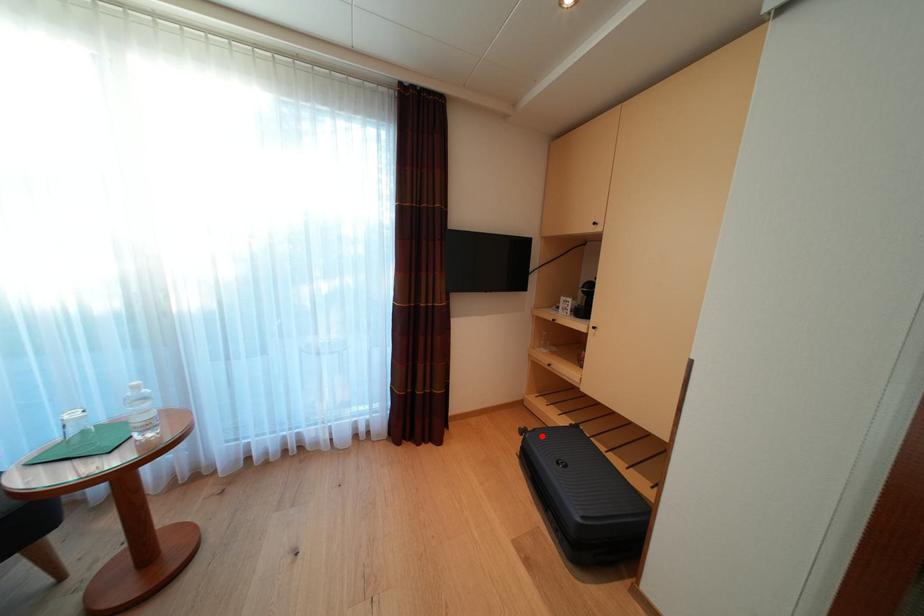
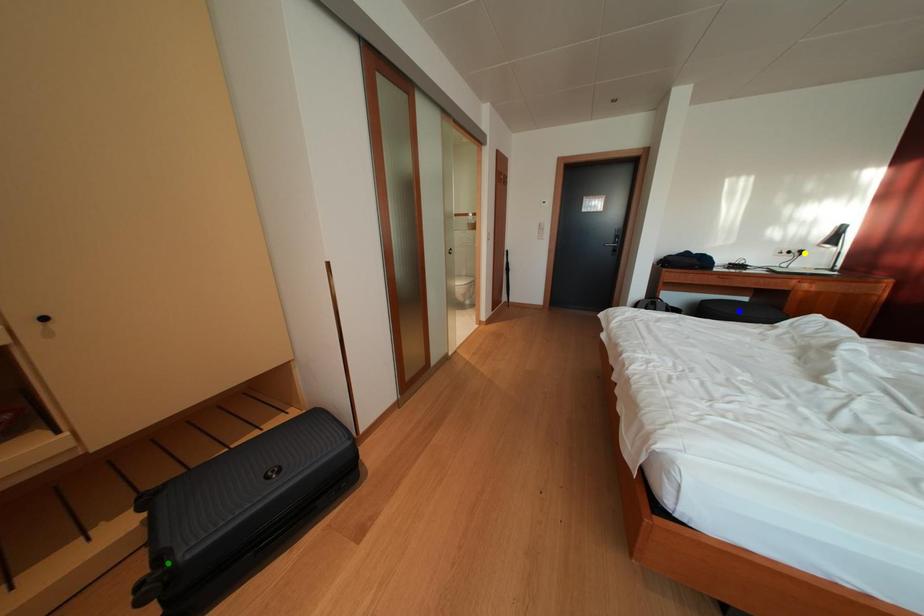
Question: I am providing you with two images of the same scene from different viewpoints. A red point is marked on the first image. You are given multiple points on the second image. Can you choose the point in image 2 that corresponds to the point in image 1?

Choices:
 (A) yellow point
 (B) green point
 (C) blue point

Answer: (B)